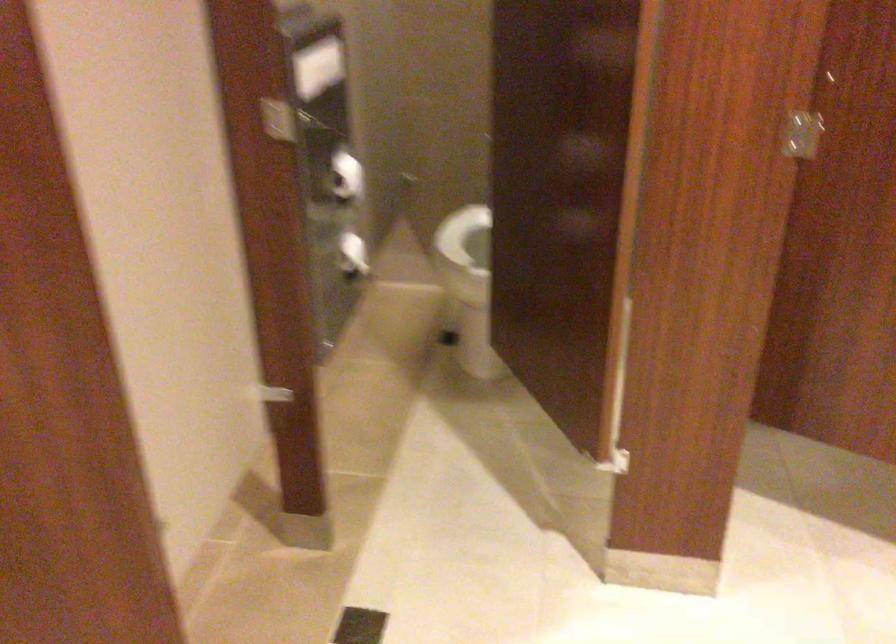
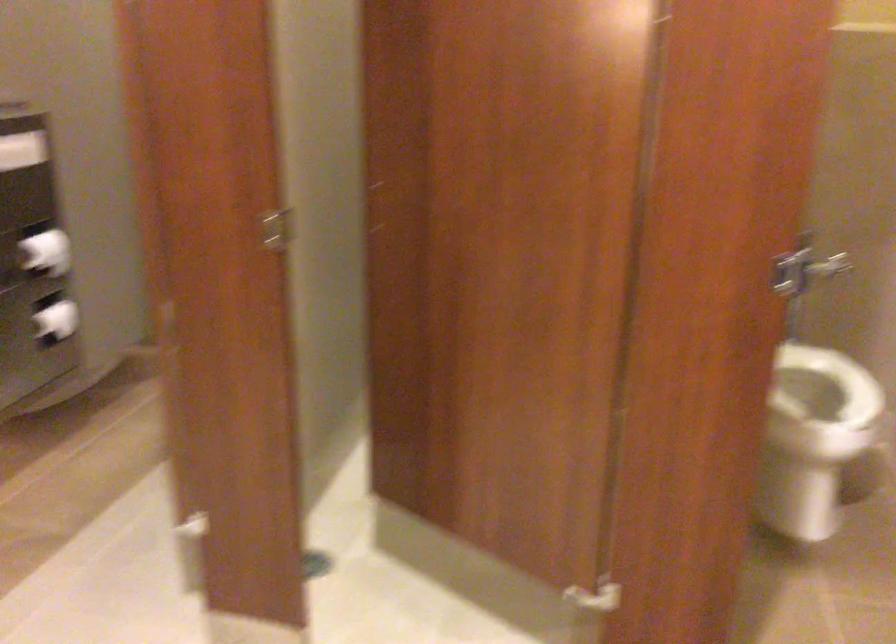
Where in the second image is the point corresponding to (x=320, y=73) from the first image?

(22, 149)